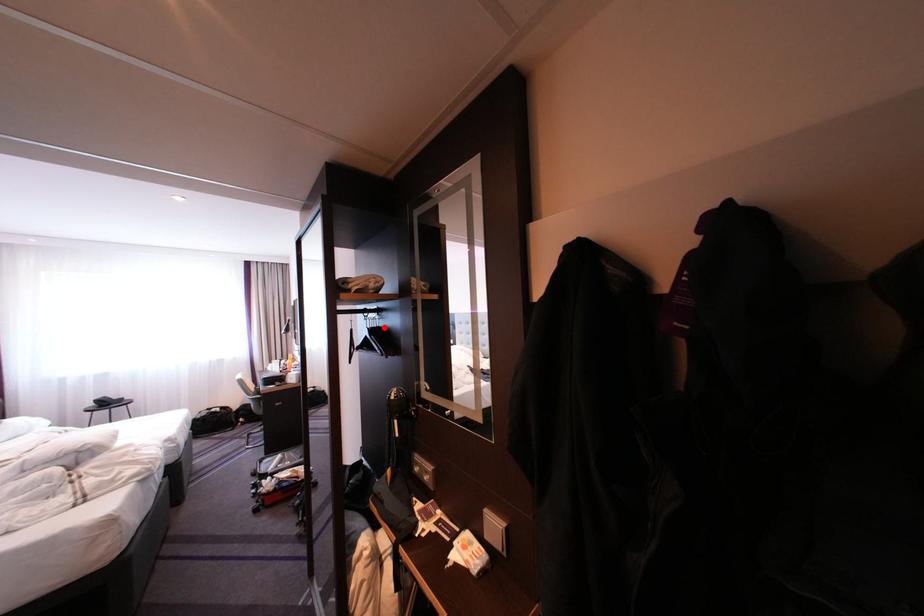
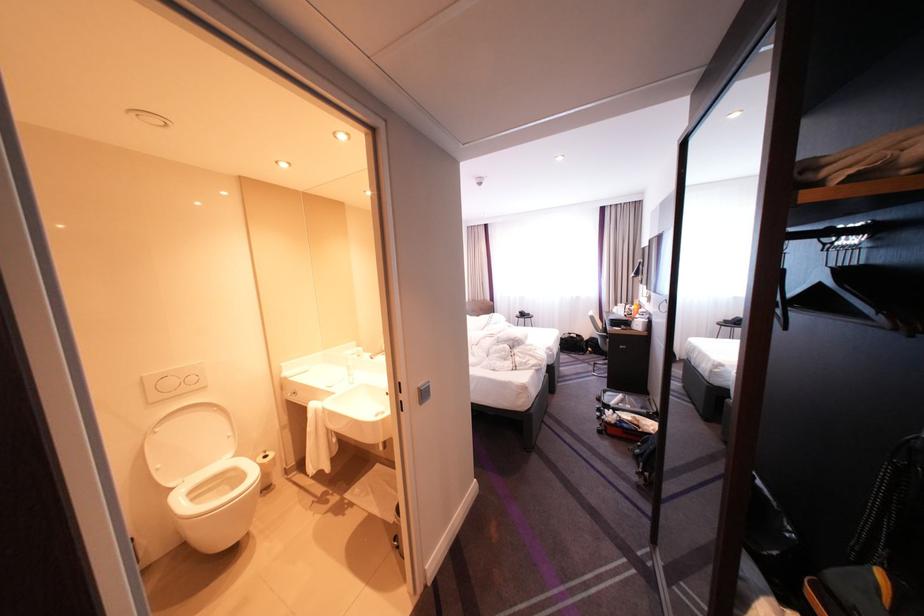
Where in the second image is the point corresponding to the highlighted location from the first image?

(855, 265)